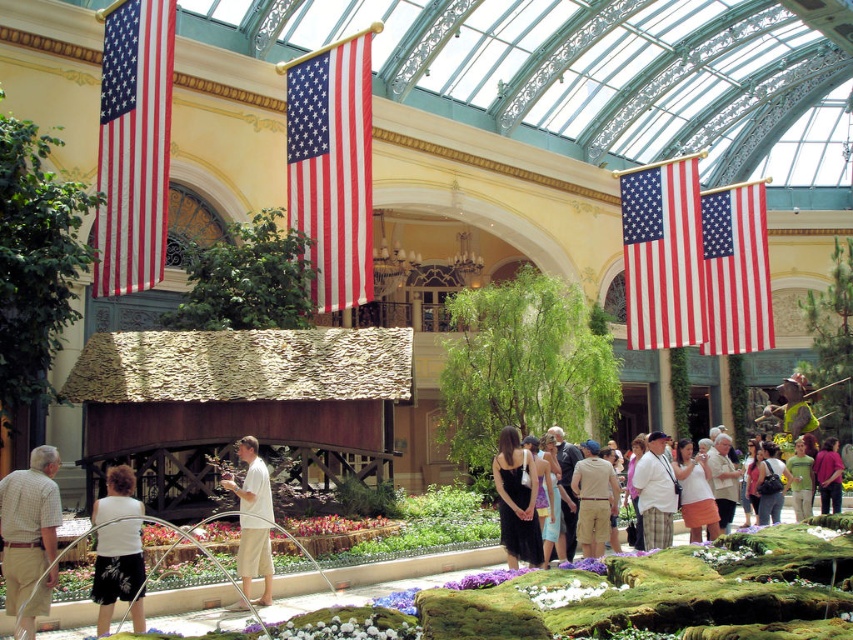
Consider the image. You are a fashion designer looking at the image. You see a black satin dress at center and a matte white blouse at center. Which clothing item is positioned higher in the scene?

The black satin dress at center is positioned higher than the matte white blouse at center.

You are a fashion designer attending a photoshoot in this botanical garden. You have two outfits to display on a model standing at the center of the scene. The outfits are the black satin dress at center and the matte white blouse at center. Which of these two outfits will appear larger in the photo?

The black satin dress at center is bigger than the matte white blouse at center, so it will appear larger in the photo.